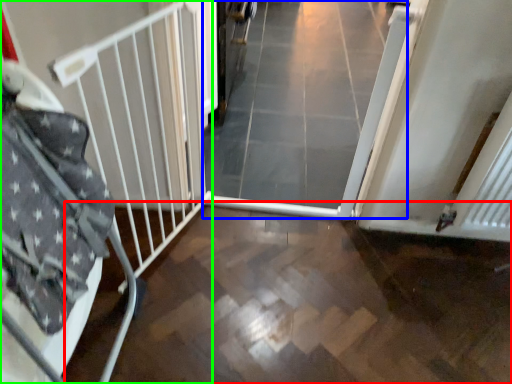
Question: Which object is the closest to the path (highlighted by a red box)? Choose among these: plain (highlighted by a blue box) or bed frame (highlighted by a green box).

Choices:
 (A) plain
 (B) bed frame

Answer: (B)